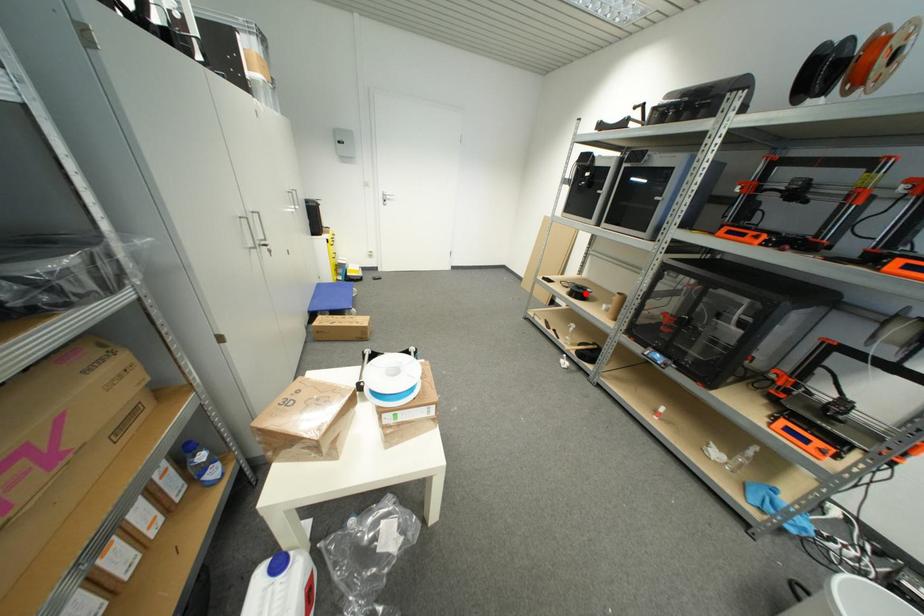
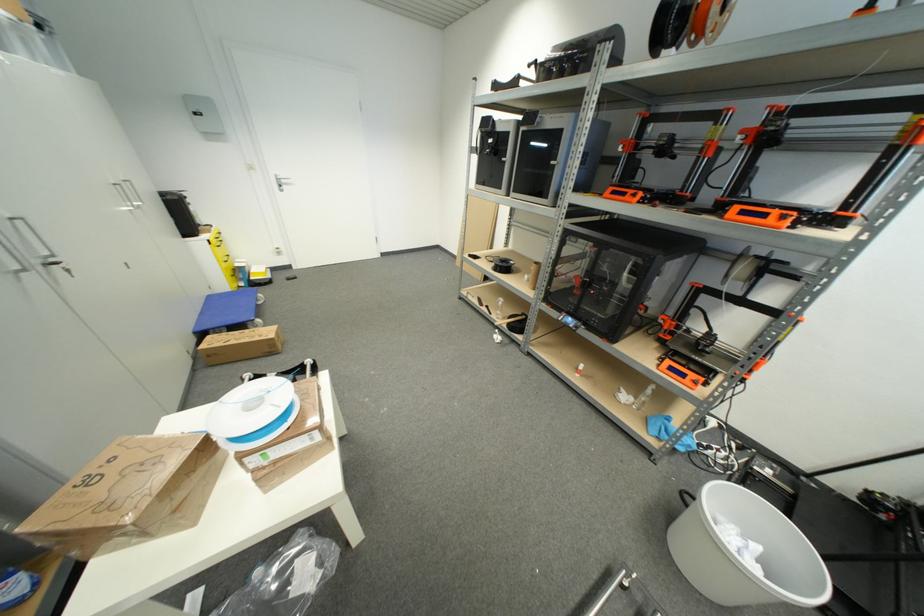
Question: A red point is marked in image1. In image2, is the corresponding 3D point closer to the camera or farther? Reply with the corresponding letter.

Choices:
 (A) The corresponding 3D point is closer.
 (B) The corresponding 3D point is farther.

Answer: (B)